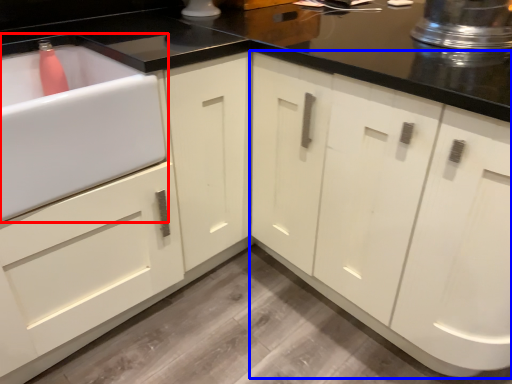
Question: Which object appears closest to the camera in this image, sink (highlighted by a red box) or cabinetry (highlighted by a blue box)?

Choices:
 (A) sink
 (B) cabinetry

Answer: (B)